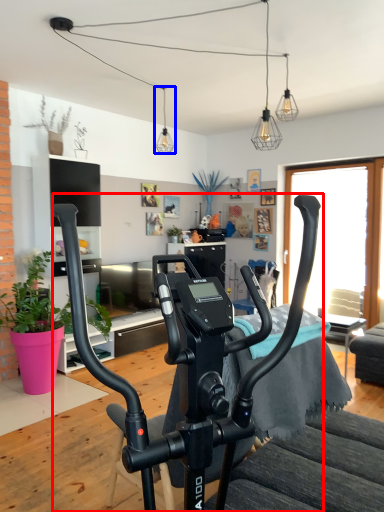
Question: Which object appears closest to the camera in this image, stationary bicycle (highlighted by a red box) or light fixture (highlighted by a blue box)?

Choices:
 (A) stationary bicycle
 (B) light fixture

Answer: (A)